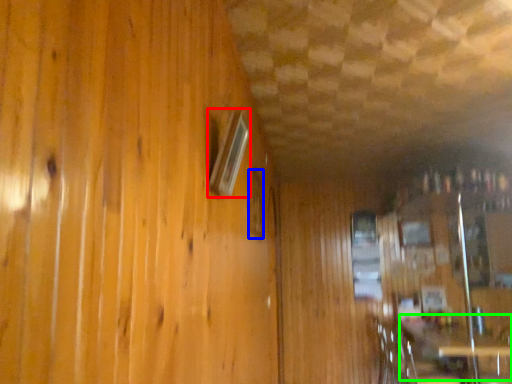
Question: Estimate the real-world distances between objects in this image. Which object is closer to window (highlighted by a red box), window (highlighted by a blue box) or table (highlighted by a green box)?

Choices:
 (A) window
 (B) table

Answer: (A)